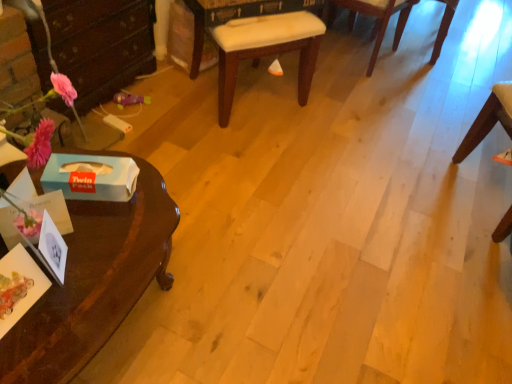
You are a GUI agent. You are given a task and a screenshot of the screen. Output one action in this format:
    pyautogui.click(x=<x>, y=<y>)
    Task: Click on the free location in front of white cardboard box at lower left, the 2th box when ordered from front to back
    
    Given the screenshot: What is the action you would take?
    pyautogui.click(x=94, y=226)